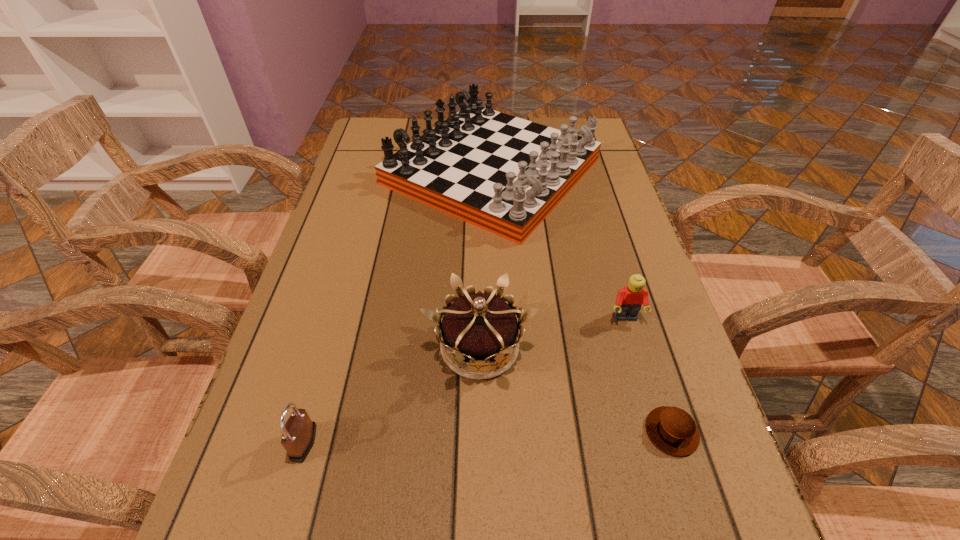
Locate an element on the screen. The image size is (960, 540). object that is at the far edge is located at coordinates (501, 173).

This screenshot has height=540, width=960. What are the coordinates of `gameboard located at the left edge` in the screenshot? It's located at (501, 173).

Where is `padlock that is at the left edge`? padlock that is at the left edge is located at coordinates (298, 434).

At what (x,y) coordinates should I click in order to perform the action: click on gameboard present at the right edge. Please return your answer as a coordinate pair (x, y). The width and height of the screenshot is (960, 540). Looking at the image, I should click on (501, 173).

I want to click on Lego present at the right edge, so point(629,299).

At what (x,y) coordinates should I click in order to perform the action: click on muffin located in the right edge section of the desktop. Please return your answer as a coordinate pair (x, y). This screenshot has width=960, height=540. Looking at the image, I should click on (672, 430).

I want to click on object that is at the far left corner, so click(501, 173).

Locate an element on the screen. The width and height of the screenshot is (960, 540). object present at the far right corner is located at coordinates (501, 173).

Where is `free space at the left edge of the desktop`? free space at the left edge of the desktop is located at coordinates (362, 172).

Where is `vacant space at the right edge`? vacant space at the right edge is located at coordinates (647, 370).